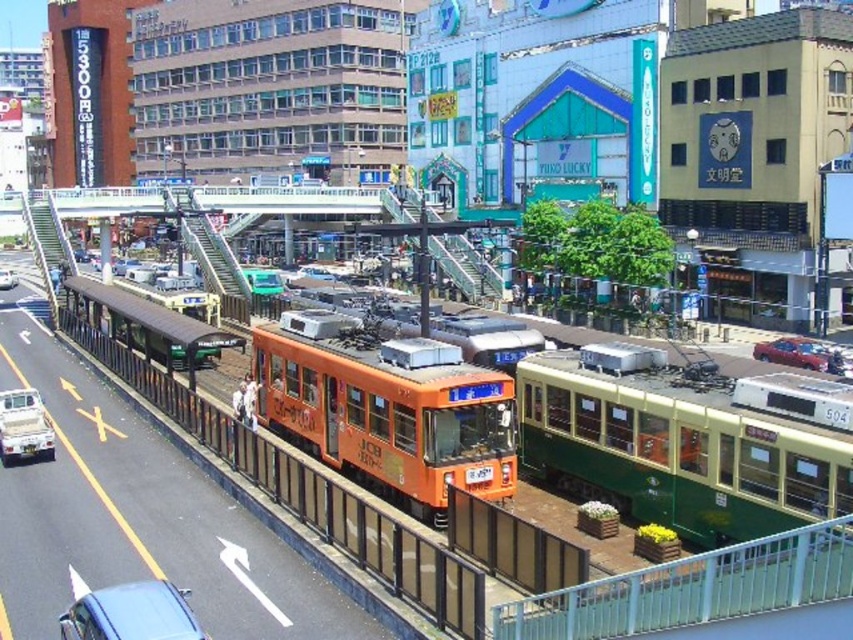
Who is positioned more to the left, green polished wood passenger train at center or metallic blue car at lower left?

metallic blue car at lower left is more to the left.

Does green polished wood passenger train at center have a greater height compared to metallic blue car at lower left?

Yes.

The image size is (853, 640). Describe the element at coordinates (683, 444) in the screenshot. I see `green polished wood passenger train at center` at that location.

Find the location of `green polished wood passenger train at center`. green polished wood passenger train at center is located at coordinates coord(683,444).

Is point (790, 346) less distant than point (12, 276)?

Yes, point (790, 346) is closer to viewer.

This screenshot has height=640, width=853. Describe the element at coordinates (804, 355) in the screenshot. I see `shiny red sedan at right` at that location.

Identify the location of shiny red sedan at right. Image resolution: width=853 pixels, height=640 pixels. (804, 355).

Does metallic blue car at lower left lie behind shiny red sedan at right?

No, it is in front of shiny red sedan at right.

Which is below, metallic blue car at lower left or shiny red sedan at right?

metallic blue car at lower left

Which is behind, point (175, 627) or point (816, 342)?

Point (816, 342)

Find the location of a particular element. This screenshot has width=853, height=640. metallic blue car at lower left is located at coordinates 131,612.